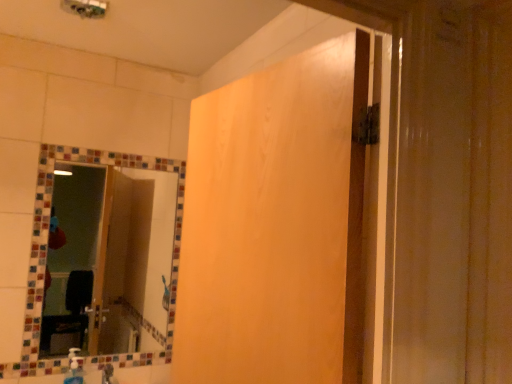
Question: Can you confirm if translucent plastic soap dispenser at lower left is taller than wooden panel at center?

Choices:
 (A) no
 (B) yes

Answer: (A)

Question: Is translucent plastic soap dispenser at lower left located outside wooden panel at center?

Choices:
 (A) yes
 (B) no

Answer: (A)

Question: Is translucent plastic soap dispenser at lower left shorter than wooden panel at center?

Choices:
 (A) yes
 (B) no

Answer: (A)

Question: Considering the relative positions of translucent plastic soap dispenser at lower left and wooden panel at center in the image provided, is translucent plastic soap dispenser at lower left behind wooden panel at center?

Choices:
 (A) yes
 (B) no

Answer: (A)

Question: Is translucent plastic soap dispenser at lower left thinner than wooden panel at center?

Choices:
 (A) yes
 (B) no

Answer: (A)

Question: From a real-world perspective, relative to wooden panel at center, is translucent plastic soap dispenser at lower left vertically above or below?

Choices:
 (A) below
 (B) above

Answer: (A)

Question: From their relative heights in the image, would you say translucent plastic soap dispenser at lower left is taller or shorter than wooden panel at center?

Choices:
 (A) tall
 (B) short

Answer: (B)

Question: Would you say translucent plastic soap dispenser at lower left is to the left or to the right of wooden panel at center in the picture?

Choices:
 (A) left
 (B) right

Answer: (A)

Question: Looking at their shapes, would you say translucent plastic soap dispenser at lower left is wider or thinner than wooden panel at center?

Choices:
 (A) wide
 (B) thin

Answer: (B)

Question: Is wooden panel at center taller or shorter than multicolored mosaic mirror at upper left?

Choices:
 (A) short
 (B) tall

Answer: (A)

Question: From the image's perspective, is wooden panel at center positioned above or below multicolored mosaic mirror at upper left?

Choices:
 (A) below
 (B) above

Answer: (B)

Question: Is wooden panel at center in front of or behind multicolored mosaic mirror at upper left in the image?

Choices:
 (A) front
 (B) behind

Answer: (A)

Question: From a real-world perspective, relative to multicolored mosaic mirror at upper left, is wooden panel at center vertically above or below?

Choices:
 (A) below
 (B) above

Answer: (B)

Question: From a real-world perspective, relative to wooden panel at center, is multicolored mosaic mirror at upper left vertically above or below?

Choices:
 (A) above
 (B) below

Answer: (B)

Question: From the image's perspective, is multicolored mosaic mirror at upper left positioned above or below wooden panel at center?

Choices:
 (A) above
 (B) below

Answer: (B)